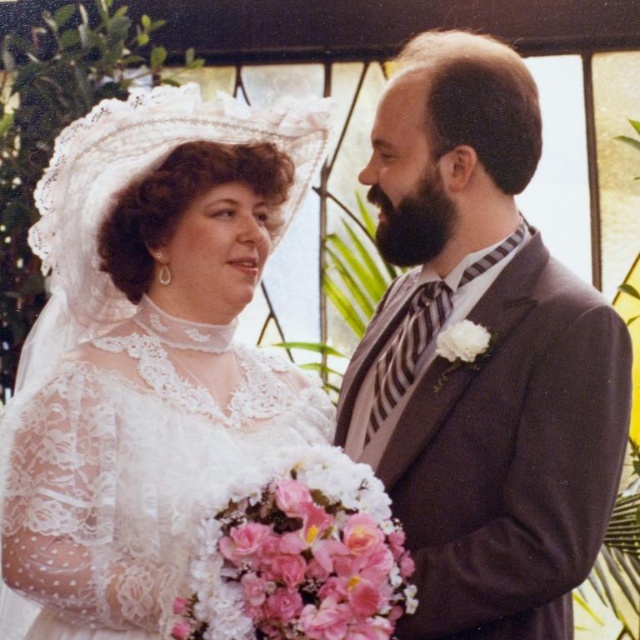
You are a photographer setting up for the wedding photoshoot. You need to ensure that both the white lace dress at left and the white matte flower at upper right are visible in the frame. Given their sizes, which object might require you to adjust your camera angle to include it properly?

The white lace dress at left requires adjusting the camera angle because its width is larger than the white matte flower at upper right, so it may need more space in the frame to be fully captured.

You are a photographer standing at the center of the wedding scene. You notice two points marked in the image. The first point is at coordinate point (81, 342) and the second is at point (467, 337). Which point is closer to your camera?

Point (81, 342) is closer to the camera than point (467, 337) because it is further to the camera than the other point.

You are a photographer adjusting your camera to focus on two specific points in the wedding scene. The first point is at coordinate point(308, 509) and the second is at point(458, 324). Which point should you focus on first if you want to capture the closest object to the camera?

Point(308, 509) is closer to the camera than point(458, 324), so you should focus on point(308, 509) first to capture the closest object.